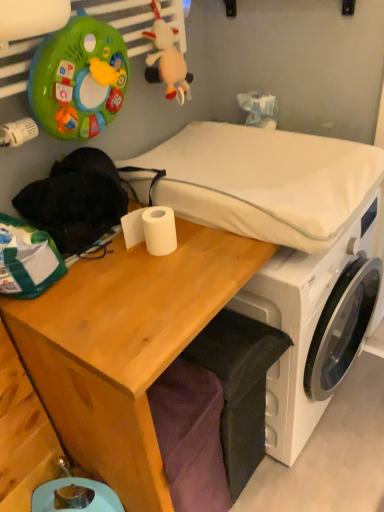
At what (x,y) coordinates should I click in order to perform the action: click on vacant space situated on the left part of white matte toilet paper at center. Please return your answer as a coordinate pair (x, y). The image size is (384, 512). Looking at the image, I should click on (102, 269).